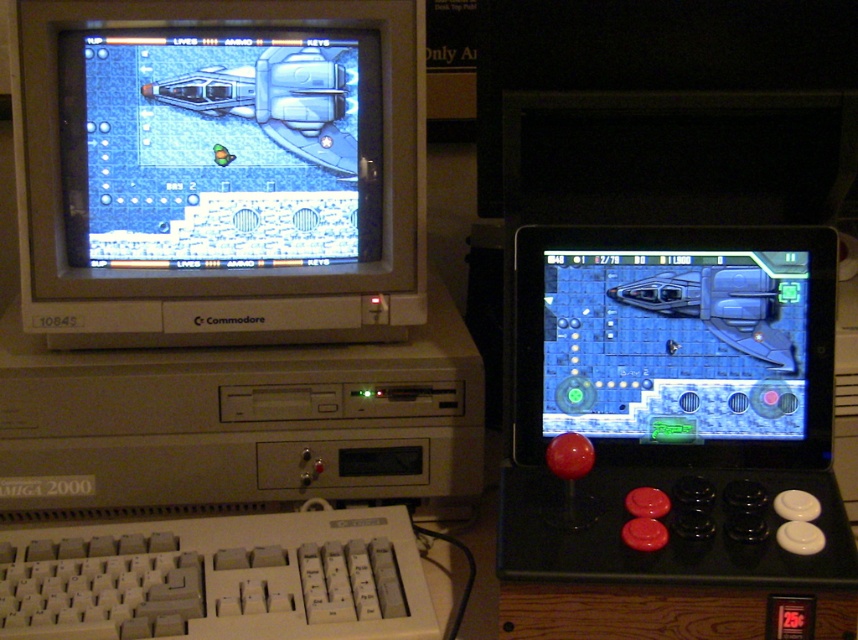
Is matte gray monitor at center above white plastic keyboard at lower left?

Indeed, matte gray monitor at center is positioned over white plastic keyboard at lower left.

Can you confirm if matte gray monitor at center is bigger than white plastic keyboard at lower left?

Yes.

Which is in front, point (355, 285) or point (234, 576)?

Point (234, 576) is more forward.

At what (x,y) coordinates should I click in order to perform the action: click on matte gray monitor at center. Please return your answer as a coordinate pair (x, y). Image resolution: width=858 pixels, height=640 pixels. Looking at the image, I should click on (219, 166).

Does matte gray monitor at center appear over metallic blue spaceship at center?

Yes, matte gray monitor at center is above metallic blue spaceship at center.

Between matte gray monitor at center and metallic blue spaceship at center, which one has more height?

With more height is matte gray monitor at center.

Between point (215, 256) and point (615, 412), which one is positioned behind?

The point (215, 256) is more distant.

In order to click on matte gray monitor at center in this screenshot , I will do `click(219, 166)`.

At what (x,y) coordinates should I click in order to perform the action: click on white plastic keyboard at lower left. Please return your answer as a coordinate pair (x, y). This screenshot has width=858, height=640. Looking at the image, I should click on (218, 579).

Which is in front, point (258, 528) or point (650, 436)?

Point (258, 528) is more forward.

This screenshot has width=858, height=640. I want to click on white plastic keyboard at lower left, so click(218, 579).